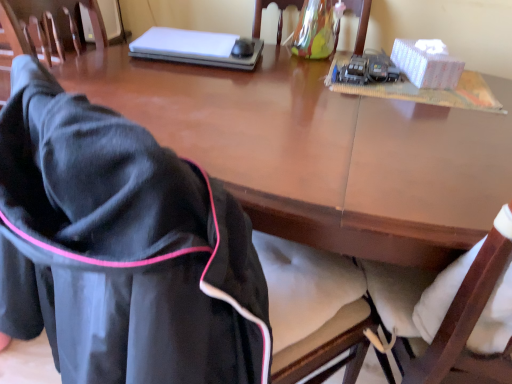
Question: Are black plastic mouse at upper center and black fabric jacket at lower left, which appears as the 2th chair when viewed from the right, located far from each other?

Choices:
 (A) no
 (B) yes

Answer: (A)

Question: From a real-world perspective, is black plastic mouse at upper center over black fabric jacket at lower left, the 1th chair in the left-to-right sequence?

Choices:
 (A) yes
 (B) no

Answer: (A)

Question: Are black plastic mouse at upper center and black fabric jacket at lower left, which appears as the second chair when viewed from the top, beside each other?

Choices:
 (A) yes
 (B) no

Answer: (B)

Question: Is black fabric jacket at lower left, the 1th chair in the left-to-right sequence, a part of black plastic mouse at upper center?

Choices:
 (A) no
 (B) yes

Answer: (A)

Question: Is black plastic mouse at upper center positioned behind black fabric jacket at lower left, which ranks as the 2th chair in back-to-front order?

Choices:
 (A) no
 (B) yes

Answer: (B)

Question: In terms of width, does black plastic mouse at upper center look wider or thinner when compared to white matte laptop at upper center?

Choices:
 (A) wide
 (B) thin

Answer: (B)

Question: Considering the positions of black plastic mouse at upper center and white matte laptop at upper center in the image, is black plastic mouse at upper center bigger or smaller than white matte laptop at upper center?

Choices:
 (A) big
 (B) small

Answer: (B)

Question: Considering the positions of point (246, 46) and point (176, 51), is point (246, 46) closer or farther from the camera than point (176, 51)?

Choices:
 (A) closer
 (B) farther

Answer: (B)

Question: Is black plastic mouse at upper center taller or shorter than white matte laptop at upper center?

Choices:
 (A) tall
 (B) short

Answer: (B)

Question: Relative to white cardboard box at upper right, is white matte laptop at upper center in front or behind?

Choices:
 (A) front
 (B) behind

Answer: (B)

Question: Based on their sizes in the image, would you say white matte laptop at upper center is bigger or smaller than white cardboard box at upper right?

Choices:
 (A) big
 (B) small

Answer: (A)

Question: Is white matte laptop at upper center inside or outside of white cardboard box at upper right?

Choices:
 (A) inside
 (B) outside

Answer: (B)

Question: From the image's perspective, is white matte laptop at upper center located above or below white cardboard box at upper right?

Choices:
 (A) below
 (B) above

Answer: (B)

Question: From a real-world perspective, is white cardboard box at upper right positioned above or below black plastic mouse at upper center?

Choices:
 (A) below
 (B) above

Answer: (B)

Question: Is white cardboard box at upper right inside or outside of black plastic mouse at upper center?

Choices:
 (A) outside
 (B) inside

Answer: (A)